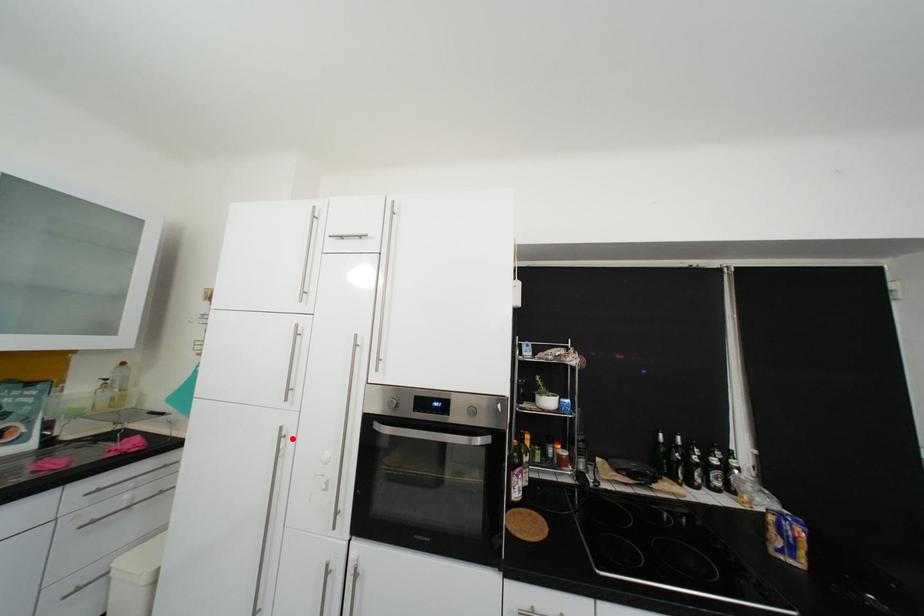
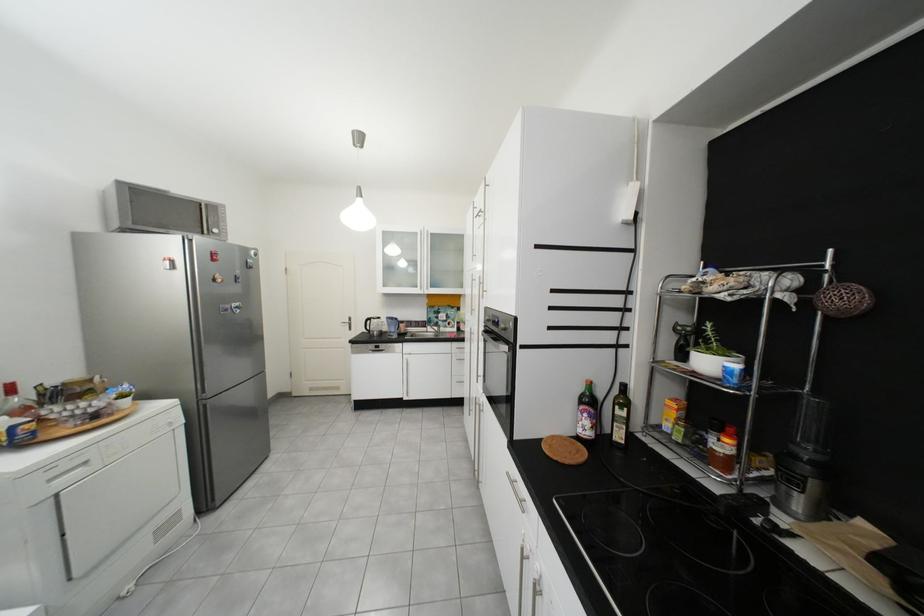
Where in the second image is the point corresponding to the highlighted location from the first image?

(482, 334)